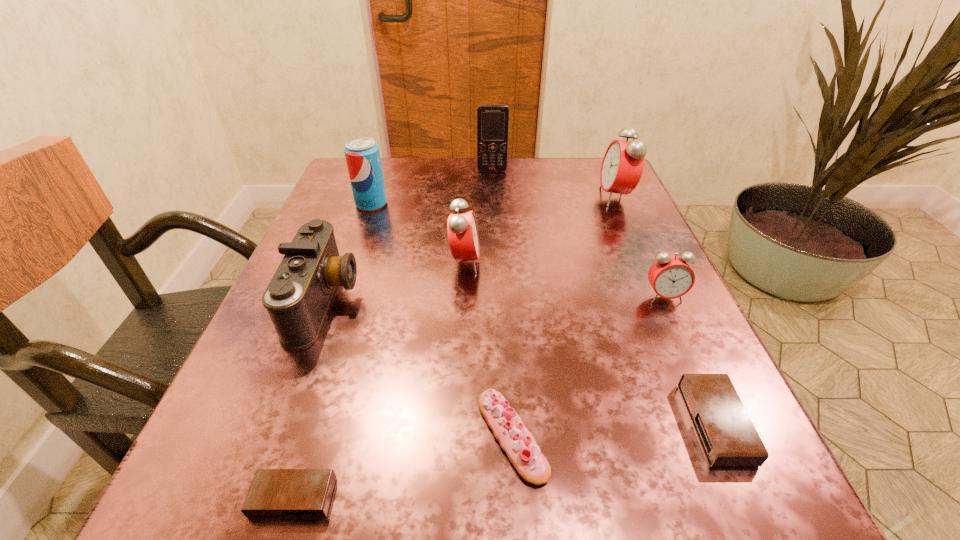
The image size is (960, 540). In order to click on vacant area between the sixth tallest object and the fourth tallest alarm clock in this screenshot , I will do `click(689, 360)`.

The height and width of the screenshot is (540, 960). I want to click on vacant region between the second shortest object and the sixth tallest object, so click(689, 360).

You are a GUI agent. You are given a task and a screenshot of the screen. Output one action in this format:
    pyautogui.click(x=<x>, y=<y>)
    Task: Click on the free area in between the nearer black alarm clock and the third nearest alarm clock
    This screenshot has width=960, height=540.
    Given the screenshot: What is the action you would take?
    pyautogui.click(x=478, y=397)

Locate an element on the screen. vacant area that lies between the nearest alarm clock and the bigger black alarm clock is located at coordinates (504, 461).

Identify which object is the closest to the orange cellular telephone. Please provide its 2D coordinates. Your answer should be formatted as a tuple, i.e. [(x, y)], where the tuple contains the x and y coordinates of a point satisfying the conditions above.

[(623, 163)]

Locate which object is the third closest to the farthest object. Please provide its 2D coordinates. Your answer should be formatted as a tuple, i.e. [(x, y)], where the tuple contains the x and y coordinates of a point satisfying the conditions above.

[(462, 231)]

Locate which alarm clock is the fourth closest to the tallest alarm clock. Please provide its 2D coordinates. Your answer should be formatted as a tuple, i.e. [(x, y)], where the tuple contains the x and y coordinates of a point satisfying the conditions above.

[(274, 493)]

Identify which alarm clock is the third closest to the soda can. Please provide its 2D coordinates. Your answer should be formatted as a tuple, i.e. [(x, y)], where the tuple contains the x and y coordinates of a point satisfying the conditions above.

[(671, 277)]

The height and width of the screenshot is (540, 960). I want to click on red alarm clock that is the third closest one to the camera, so click(x=623, y=163).

At what (x,y) coordinates should I click in order to perform the action: click on red alarm clock that stands as the second closest to the second farthest alarm clock. Please return your answer as a coordinate pair (x, y). Looking at the image, I should click on (623, 163).